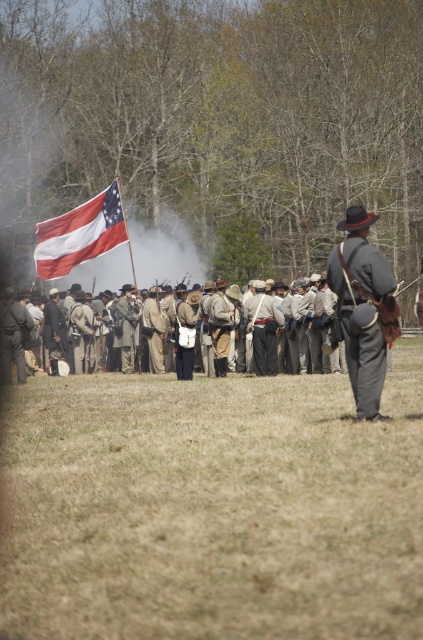
Question: Considering the relative positions of gray woolen coat at right and red-white striped flag at center-left in the image provided, where is gray woolen coat at right located with respect to red-white striped flag at center-left?

Choices:
 (A) above
 (B) below

Answer: (B)

Question: Which object appears closest to the camera in this image?

Choices:
 (A) red-white striped flag at center-left
 (B) gray woolen coat at right
 (C) light brown leather jacket at center

Answer: (B)

Question: Which point appears farthest from the camera in this image?

Choices:
 (A) (123, 305)
 (B) (219, 346)
 (C) (49, 268)

Answer: (C)

Question: Does gray woolen coat at right come behind brown leather jacket at center?

Choices:
 (A) no
 (B) yes

Answer: (A)

Question: Does light brown fabric uniform at center appear over light brown leather jacket at center?

Choices:
 (A) yes
 (B) no

Answer: (A)

Question: Which of the following is the farthest from the observer?

Choices:
 (A) red-white striped flag at center-left
 (B) light brown fabric uniform at center

Answer: (A)